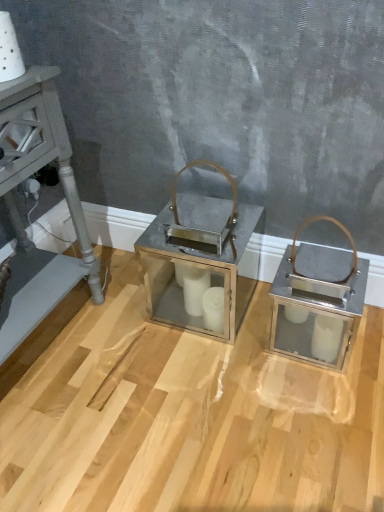
Question: Considering the relative sizes of metallic gray side table at left and metallic silver lantern at center in the image provided, is metallic gray side table at left wider than metallic silver lantern at center?

Choices:
 (A) no
 (B) yes

Answer: (B)

Question: From the image's perspective, does metallic gray side table at left appear lower than metallic silver lantern at center?

Choices:
 (A) no
 (B) yes

Answer: (B)

Question: Is metallic gray side table at left to the left of metallic silver lantern at center from the viewer's perspective?

Choices:
 (A) no
 (B) yes

Answer: (B)

Question: Considering the relative positions of metallic gray side table at left and metallic silver lantern at center in the image provided, is metallic gray side table at left to the right of metallic silver lantern at center from the viewer's perspective?

Choices:
 (A) yes
 (B) no

Answer: (B)

Question: Is metallic gray side table at left looking in the opposite direction of metallic silver lantern at center?

Choices:
 (A) yes
 (B) no

Answer: (B)

Question: Does metallic gray side table at left turn towards metallic silver lantern at center?

Choices:
 (A) yes
 (B) no

Answer: (A)

Question: From a real-world perspective, is metallic silver lantern at center positioned under metallic gray side table at left based on gravity?

Choices:
 (A) no
 (B) yes

Answer: (B)

Question: Is metallic silver lantern at center aimed at metallic gray side table at left?

Choices:
 (A) yes
 (B) no

Answer: (B)

Question: Considering the relative sizes of metallic silver lantern at center and metallic gray side table at left in the image provided, is metallic silver lantern at center smaller than metallic gray side table at left?

Choices:
 (A) yes
 (B) no

Answer: (A)

Question: Is metallic silver lantern at center to the left of metallic gray side table at left from the viewer's perspective?

Choices:
 (A) no
 (B) yes

Answer: (A)

Question: Is metallic silver lantern at center not inside metallic gray side table at left?

Choices:
 (A) no
 (B) yes

Answer: (B)

Question: Can you see metallic silver lantern at center touching metallic gray side table at left?

Choices:
 (A) yes
 (B) no

Answer: (B)

Question: Considering the relative positions of metallic silver lantern at center and metallic gray side table at left in the image provided, is metallic silver lantern at center to the left or to the right of metallic gray side table at left?

Choices:
 (A) left
 (B) right

Answer: (B)